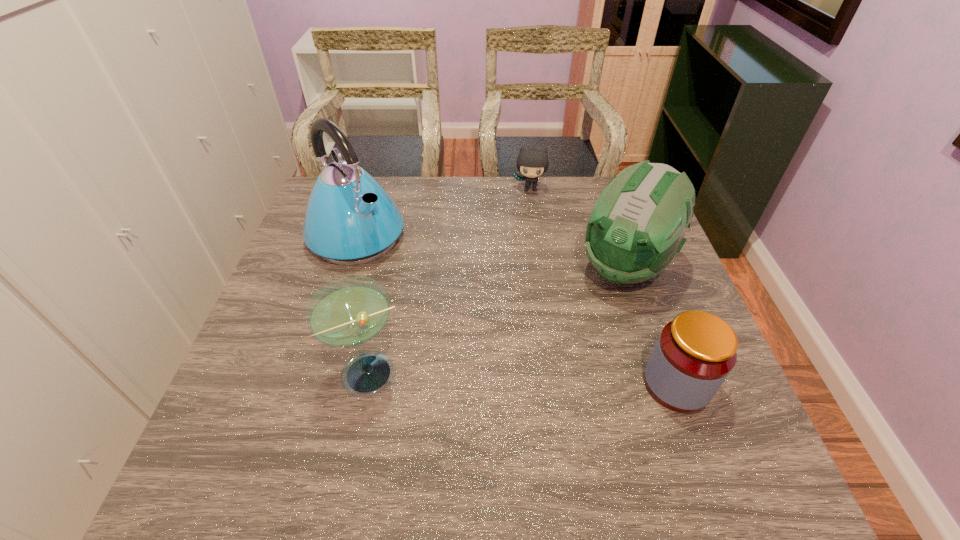
Find the location of a particular element. vacant space situated 0.390m on the visor of the fourth shortest object is located at coordinates (517, 411).

Image resolution: width=960 pixels, height=540 pixels. Find the location of `vacant area located 0.350m on the front-facing side of the third object from left to right`. vacant area located 0.350m on the front-facing side of the third object from left to right is located at coordinates (522, 271).

This screenshot has width=960, height=540. What are the coordinates of `vacant region located on the front-facing side of the third object from left to right` in the screenshot? It's located at (527, 207).

Where is `vacant point located on the front-facing side of the third object from left to right`? vacant point located on the front-facing side of the third object from left to right is located at coordinates (525, 231).

The height and width of the screenshot is (540, 960). Find the location of `vacant point located at the spout of the tallest object`. vacant point located at the spout of the tallest object is located at coordinates (438, 304).

The height and width of the screenshot is (540, 960). I want to click on free space located 0.190m at the spout of the tallest object, so (430, 298).

Identify the location of free region located at the spout of the tallest object. (422, 292).

Where is `kitten that is at the far edge`? kitten that is at the far edge is located at coordinates (532, 163).

Locate an element on the screen. The height and width of the screenshot is (540, 960). kettle at the far edge is located at coordinates (350, 219).

The width and height of the screenshot is (960, 540). What are the coordinates of `martini that is at the near edge` in the screenshot? It's located at (348, 312).